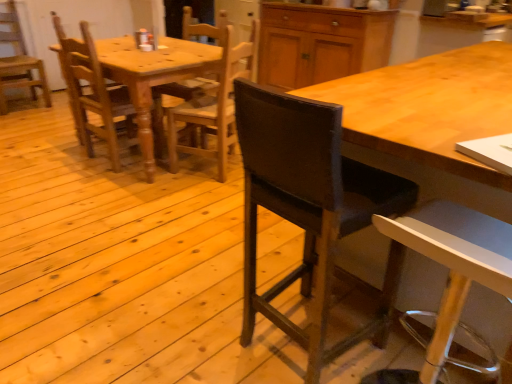
What are the coordinates of `vacant area that is in front of wooden chair at center, the 3th chair positioned from the left` in the screenshot? It's located at (195, 195).